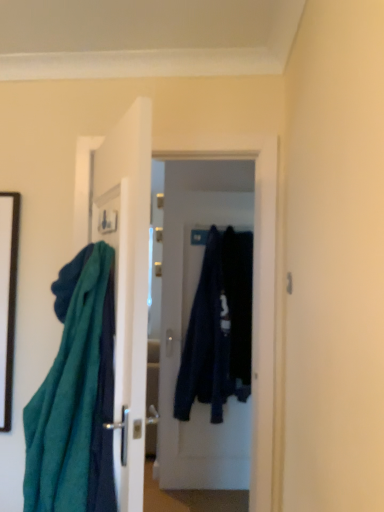
Question: From the image's perspective, is teal fabric at left positioned above or below dark blue fabric at center, which appears as the 1th clothing when viewed from the left?

Choices:
 (A) below
 (B) above

Answer: (A)

Question: Is teal fabric at left taller or shorter than dark blue fabric at center, which appears as the 1th clothing when viewed from the left?

Choices:
 (A) tall
 (B) short

Answer: (B)

Question: Which object is positioned farthest from the teal fabric at left?

Choices:
 (A) dark blue fabric at center, marked as the first door in a right-to-left arrangement
 (B) white glossy door at center, acting as the second door starting from the right
 (C) black matte picture frame at left
 (D) dark blue fabric at center, which appears as the 1th clothing when viewed from the left
 (E) dark blue fabric at center, which ranks as the first clothing in right-to-left order

Answer: (A)

Question: Based on their relative distances, which object is nearer to the dark blue fabric at center, which ranks as the first clothing in right-to-left order?

Choices:
 (A) dark blue fabric at center, which appears as the 1th clothing when viewed from the left
 (B) teal fabric at left
 (C) white glossy door at center, the 1th door from the left
 (D) dark blue fabric at center, the second door in the front-to-back sequence
 (E) black matte picture frame at left

Answer: (A)